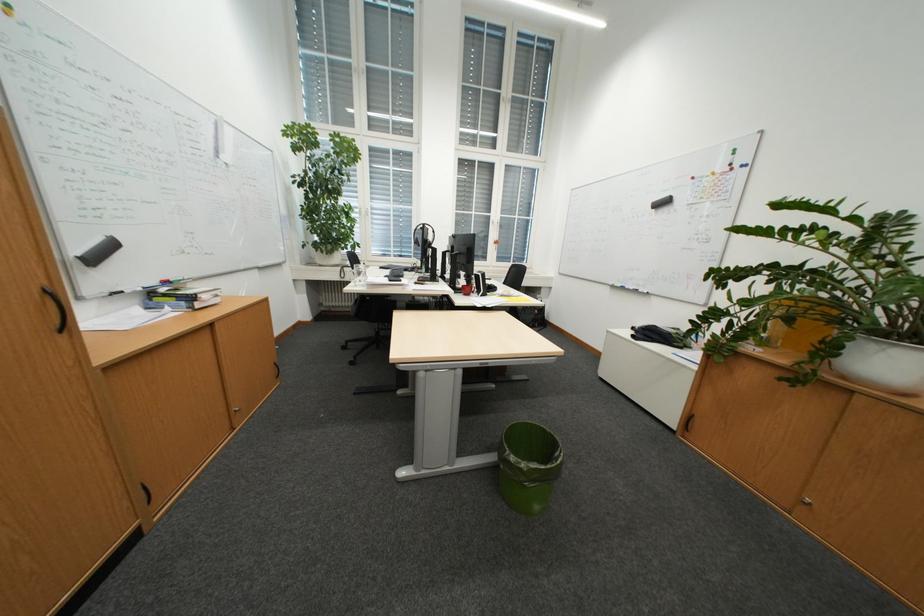
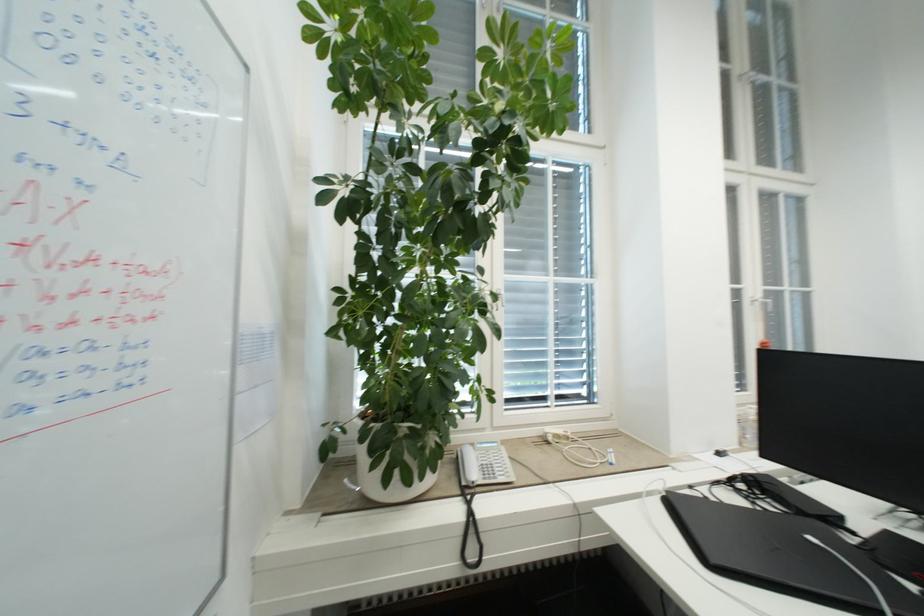
In a continuous first-person perspective shot, in which direction is the camera moving?

The movement direction of the cameraman is left, forward.